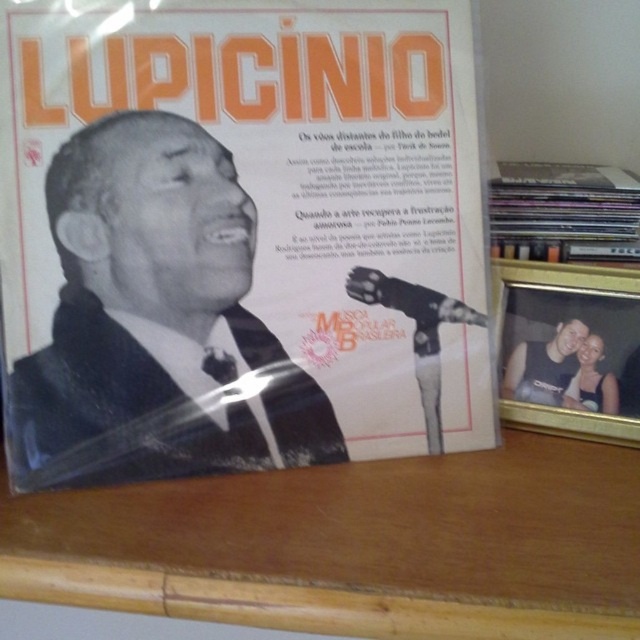
Question: Which point is farther to the camera?

Choices:
 (A) matte black vinyl records at upper right
 (B) matte black tank top at lower right
 (C) matte black suit at center

Answer: (B)

Question: Which of the following is the farthest from the observer?

Choices:
 (A) (552, 244)
 (B) (513, 385)

Answer: (A)

Question: Can you confirm if matte black vinyl records at upper right is positioned to the right of matte black tank top at lower right?

Choices:
 (A) no
 (B) yes

Answer: (B)

Question: Estimate the real-world distances between objects in this image. Which object is farther from the matte black vinyl records at upper right?

Choices:
 (A) matte black suit at center
 (B) matte black tank top at lower right

Answer: (A)

Question: Can you confirm if matte black suit at center is smaller than matte black tank top at lower right?

Choices:
 (A) yes
 (B) no

Answer: (B)

Question: Is matte black suit at center closer to camera compared to matte black vinyl records at upper right?

Choices:
 (A) no
 (B) yes

Answer: (B)